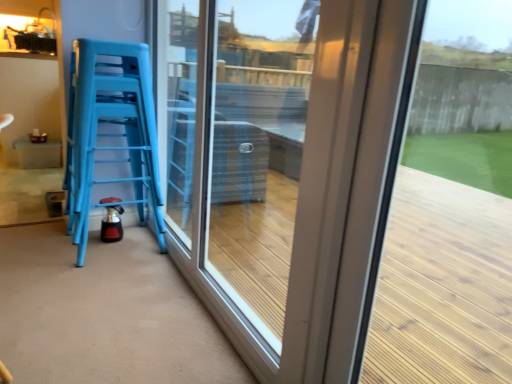
You are a GUI agent. You are given a task and a screenshot of the screen. Output one action in this format:
    pyautogui.click(x=<x>, y=<y>)
    Task: Click on the transparent glass door at center
    This screenshot has width=512, height=384.
    Given the screenshot: What is the action you would take?
    tap(343, 182)

The height and width of the screenshot is (384, 512). What do you see at coordinates (343, 182) in the screenshot?
I see `transparent glass door at center` at bounding box center [343, 182].

Identify the location of blue plastic stools at left. (111, 134).

Measure the distance between blue plastic stools at left and camera.

blue plastic stools at left is 5.97 feet from camera.

What do you see at coordinates (111, 134) in the screenshot?
I see `blue plastic stools at left` at bounding box center [111, 134].

Image resolution: width=512 pixels, height=384 pixels. Identify the location of transparent glass door at center. (343, 182).

Is blue plastic stools at left to the left or to the right of transparent glass door at center in the image?

Clearly, blue plastic stools at left is on the left of transparent glass door at center in the image.

Which object is further away from the camera, blue plastic stools at left or transparent glass door at center?

blue plastic stools at left is further from the camera.

Does point (81, 75) come in front of point (233, 62)?

Yes, point (81, 75) is in front of point (233, 62).

Looking at this image, from the image's perspective, is blue plastic stools at left below transparent glass door at center?

No.

From a real-world perspective, is blue plastic stools at left physically located above or below transparent glass door at center?

In terms of real-world spatial position, blue plastic stools at left is below transparent glass door at center.

In terms of width, does blue plastic stools at left look wider or thinner when compared to transparent glass door at center?

Clearly, blue plastic stools at left has more width compared to transparent glass door at center.

Does blue plastic stools at left have a lesser height compared to transparent glass door at center?

Yes, blue plastic stools at left is shorter than transparent glass door at center.

Is blue plastic stools at left bigger than transparent glass door at center?

Actually, blue plastic stools at left might be smaller than transparent glass door at center.

Is transparent glass door at center completely or partially inside blue plastic stools at left?

No.

Does blue plastic stools at left touch transparent glass door at center?

They are not placed beside each other.

Does blue plastic stools at left turn towards transparent glass door at center?

No, blue plastic stools at left is not turned towards transparent glass door at center.

Find the location of a particular element. Image resolution: width=512 pixels, height=384 pixels. furniture above the transparent glass door at center (from the image's perspective) is located at coordinates (111, 134).

Considering the relative positions of transparent glass door at center and blue plastic stools at left in the image provided, is transparent glass door at center to the left or to the right of blue plastic stools at left?

From the image, it's evident that transparent glass door at center is to the right of blue plastic stools at left.

Who is more distant, transparent glass door at center or blue plastic stools at left?

blue plastic stools at left.

Which point is more forward, (x=418, y=54) or (x=147, y=48)?

The point (x=418, y=54) is in front.

In the scene shown: From the image's perspective, is transparent glass door at center beneath blue plastic stools at left?

Yes, from the image's perspective, transparent glass door at center is beneath blue plastic stools at left.

From a real-world perspective, relative to blue plastic stools at left, is transparent glass door at center vertically above or below?

In terms of real-world spatial position, transparent glass door at center is above blue plastic stools at left.

Considering the sizes of transparent glass door at center and blue plastic stools at left in the image, is transparent glass door at center wider or thinner than blue plastic stools at left?

transparent glass door at center is thinner than blue plastic stools at left.

Is transparent glass door at center taller than blue plastic stools at left?

Yes.

Consider the image. Considering the sizes of objects transparent glass door at center and blue plastic stools at left in the image provided, who is smaller, transparent glass door at center or blue plastic stools at left?

Smaller between the two is blue plastic stools at left.

Is transparent glass door at center inside or outside of blue plastic stools at left?

The correct answer is: outside.

Is transparent glass door at center not near blue plastic stools at left?

Actually, transparent glass door at center and blue plastic stools at left are a little close together.

Is transparent glass door at center facing away from blue plastic stools at left?

→ Correct, transparent glass door at center is looking away from blue plastic stools at left.

Can you tell me how much transparent glass door at center and blue plastic stools at left differ in facing direction?

transparent glass door at center and blue plastic stools at left are facing 93.2 degrees away from each other.

How far apart are transparent glass door at center and blue plastic stools at left?

transparent glass door at center is 18.14 inches from blue plastic stools at left.

You are a GUI agent. You are given a task and a screenshot of the screen. Output one action in this format:
    pyautogui.click(x=<x>, y=<y>)
    Task: Click on the window above the blue plastic stools at left (from a real-world perspective)
    The width and height of the screenshot is (512, 384).
    Given the screenshot: What is the action you would take?
    pyautogui.click(x=343, y=182)

Image resolution: width=512 pixels, height=384 pixels. I want to click on furniture behind the transparent glass door at center, so click(x=111, y=134).

Find the location of `furniture to the left of transparent glass door at center`. furniture to the left of transparent glass door at center is located at coordinates (111, 134).